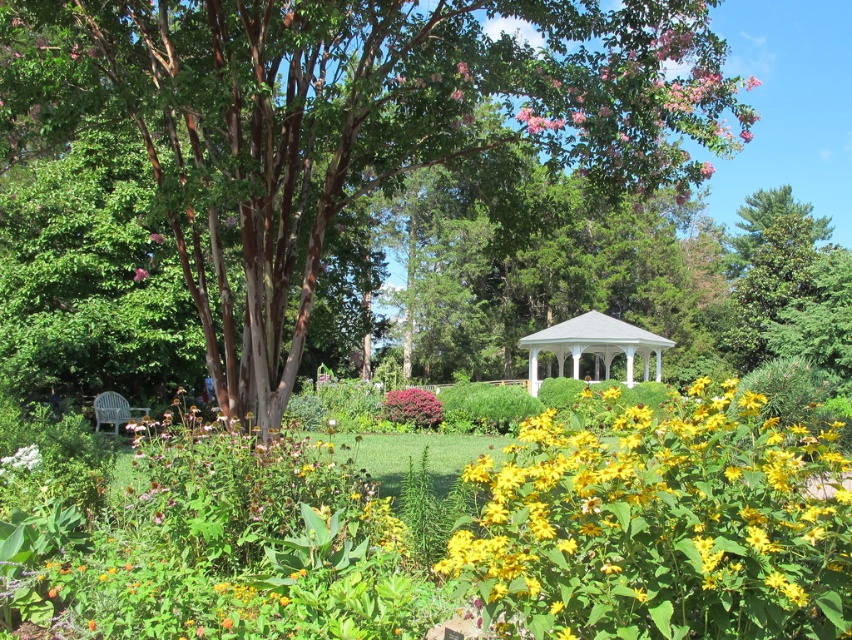
Question: From the image, what is the correct spatial relationship of brown textured tree at center in relation to purple matte bush at center?

Choices:
 (A) above
 (B) below

Answer: (A)

Question: Among these objects, which one is farthest from the camera?

Choices:
 (A) yellow matte flower at center
 (B) brown textured tree at center

Answer: (B)

Question: Is yellow matte flower at center above pink matte flower at center?

Choices:
 (A) no
 (B) yes

Answer: (A)

Question: Which of the following is the farthest from the observer?

Choices:
 (A) (139, 276)
 (B) (470, 144)

Answer: (A)

Question: Is yellow matte flower at center below white painted wood gazebo at center?

Choices:
 (A) yes
 (B) no

Answer: (A)

Question: Among these points, which one is nearest to the camera?

Choices:
 (A) (553, 348)
 (B) (547, 627)
 (C) (291, 323)

Answer: (B)